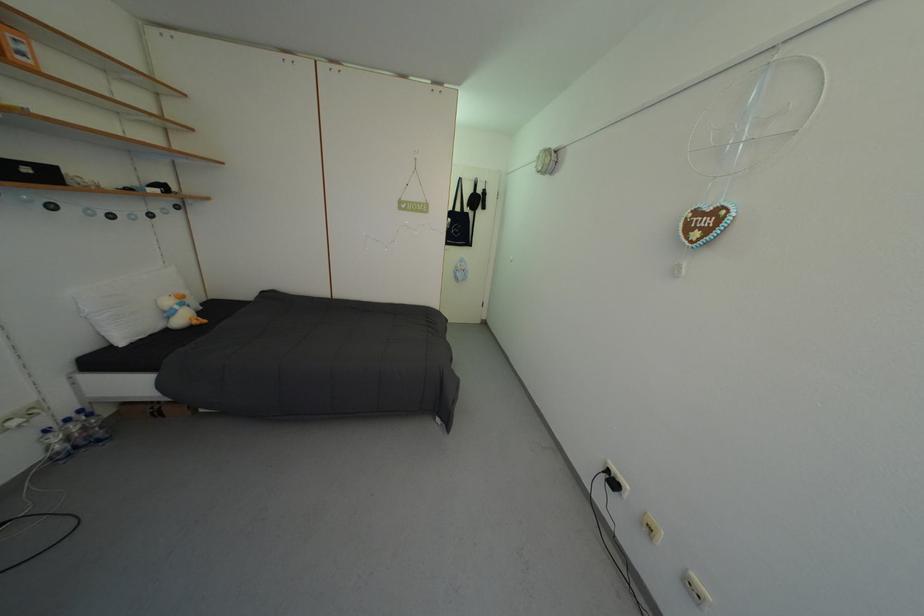
This screenshot has width=924, height=616. What are the coordinates of `stuffed duck toy` in the screenshot? It's located at (178, 310).